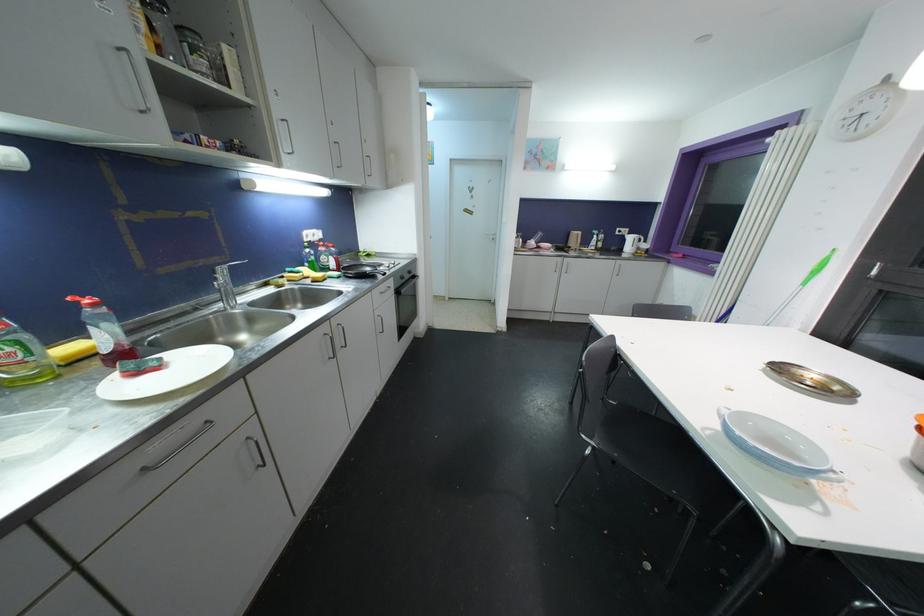
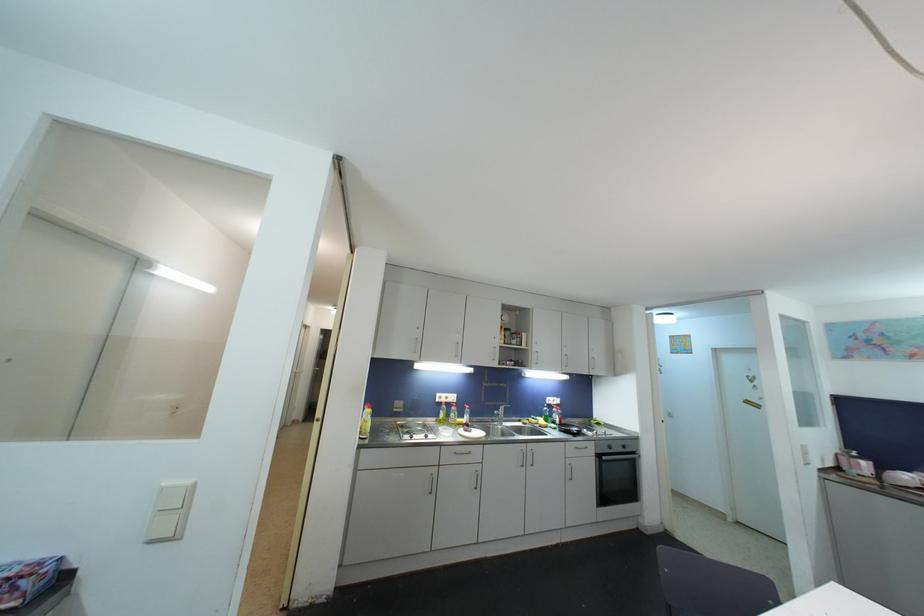
In the second image, find the point that corresponds to the point at 406,281 in the first image.

(613, 450)